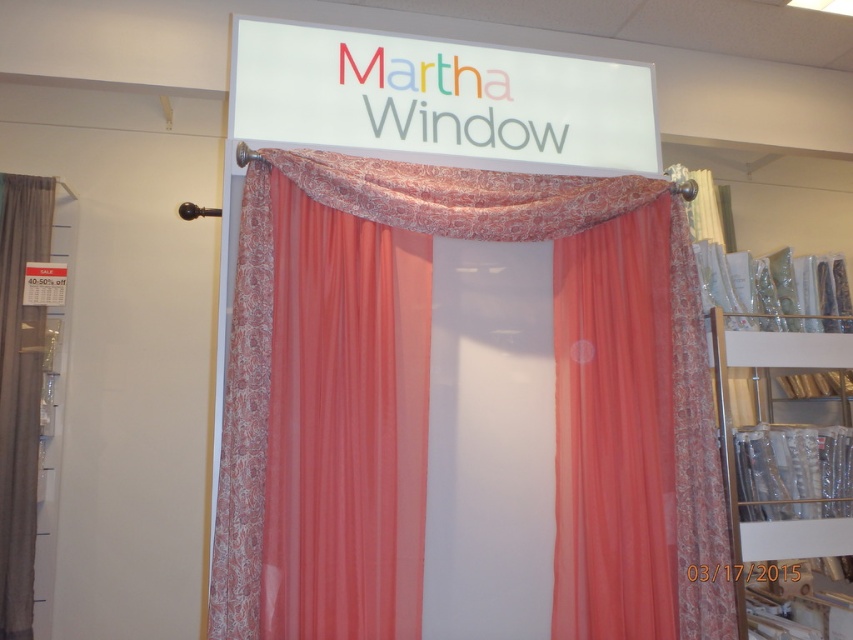
You are standing in the retail store and want to place a new display stand at the point marked by coordinates point (x=787, y=484). What object is located at that point?

The point (x=787, y=484) corresponds to the metallic gold bookshelf at right.

You are a customer in a store looking at two curtains. The coral sheer curtain at center and the matte gray curtain at left. Which one is bigger in size?

The coral sheer curtain at center is larger in size compared to the matte gray curtain at left.